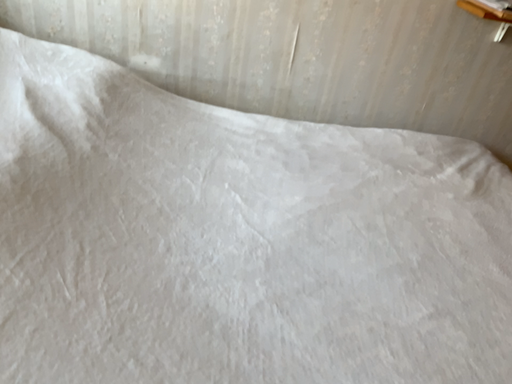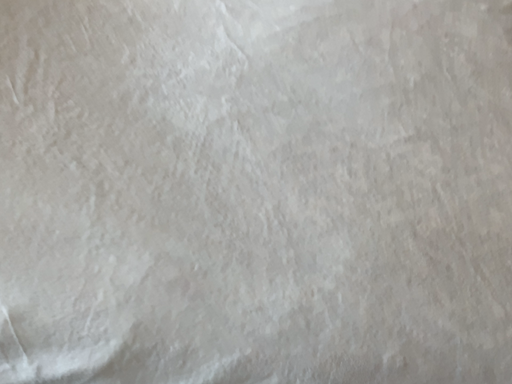
Question: Which way did the camera rotate in the video?

Choices:
 (A) rotated right
 (B) rotated left

Answer: (B)